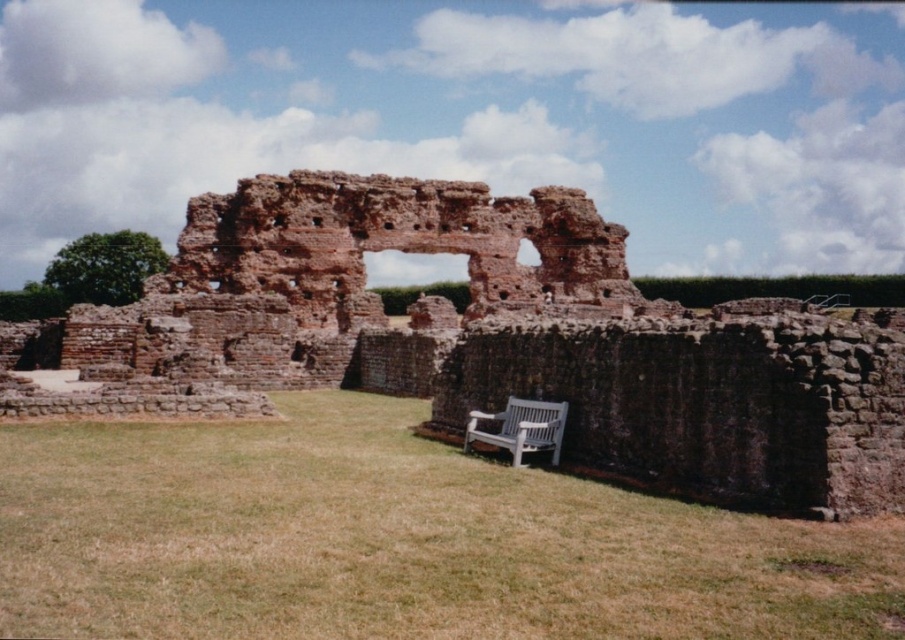
What do you see at coordinates (505, 339) in the screenshot? This screenshot has width=905, height=640. I see `brown stone ruins at center` at bounding box center [505, 339].

Between brown stone ruins at center and white wooden bench at lower center, which one has more height?

Standing taller between the two is brown stone ruins at center.

What do you see at coordinates (505, 339) in the screenshot? This screenshot has height=640, width=905. I see `brown stone ruins at center` at bounding box center [505, 339].

You are a GUI agent. You are given a task and a screenshot of the screen. Output one action in this format:
    pyautogui.click(x=<x>, y=<y>)
    Task: Click on the brown stone ruins at center
    The image size is (905, 640).
    Given the screenshot: What is the action you would take?
    pyautogui.click(x=505, y=339)